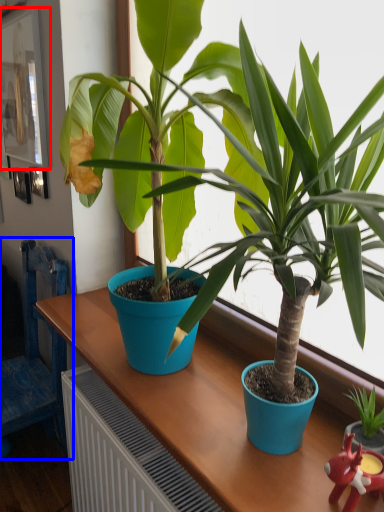
Question: Which object is further to the camera taking this photo, picture frame (highlighted by a red box) or chair (highlighted by a blue box)?

Choices:
 (A) picture frame
 (B) chair

Answer: (A)